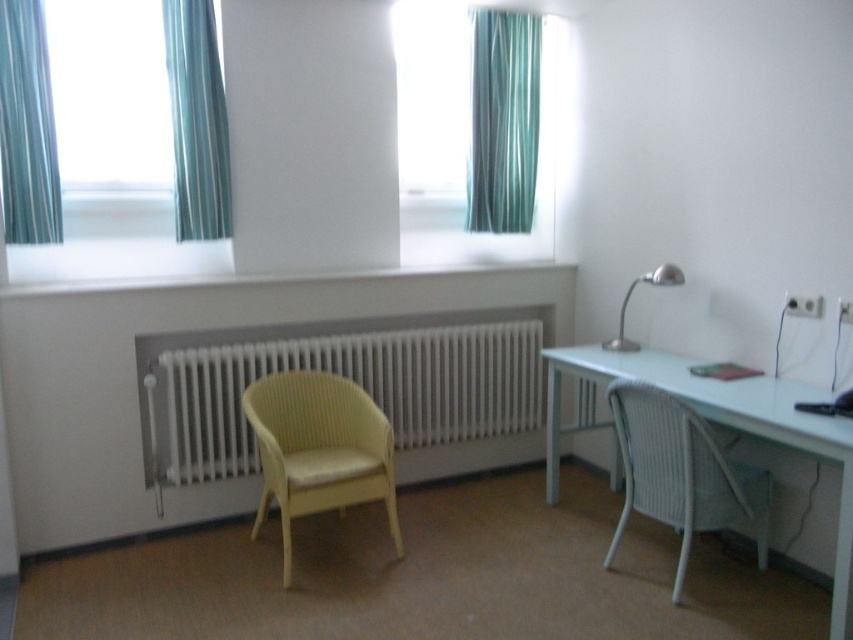
What is the 2D coordinate of the blue striped curtain at upper left in the room?

The blue striped curtain at upper left is located at the 2D coordinate point of (196, 122).

You are standing in the room and want to know which of the two points, point (368,406) or point (689,490), is closer to you. Based on their positions, can you determine which one is nearer?

Point (368,406) is further to the camera than point (689,490), so the point closer to you is point (689,490).

In the scene shown: You are standing at the entrance of the room and want to sit in the yellow wicker chair at center. According to the room layout, in which direction should you move to reach the chair?

The yellow wicker chair at center is located at point 0.703 on the x and 0.374 on the y axis. Since you are at the entrance, you should move towards the center of the room to reach the chair.